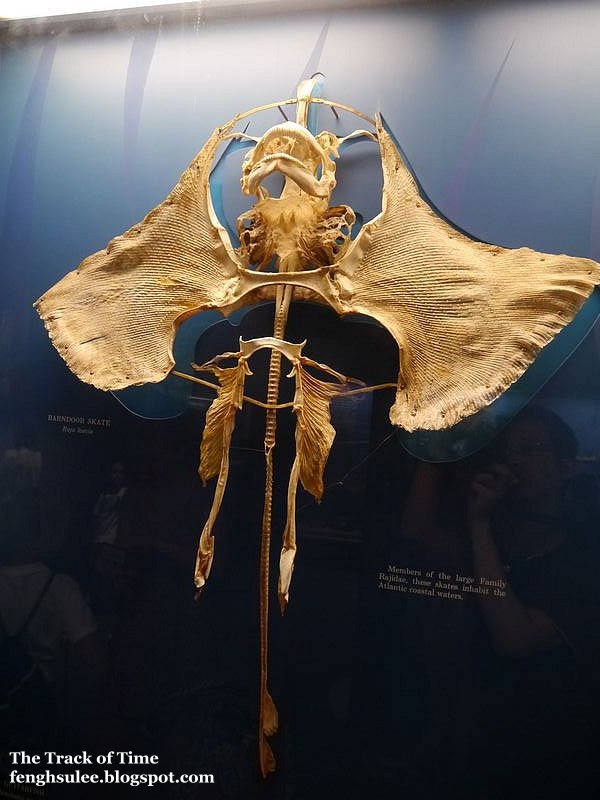
The width and height of the screenshot is (600, 800). In order to click on wall in this screenshot , I will do `click(70, 656)`.